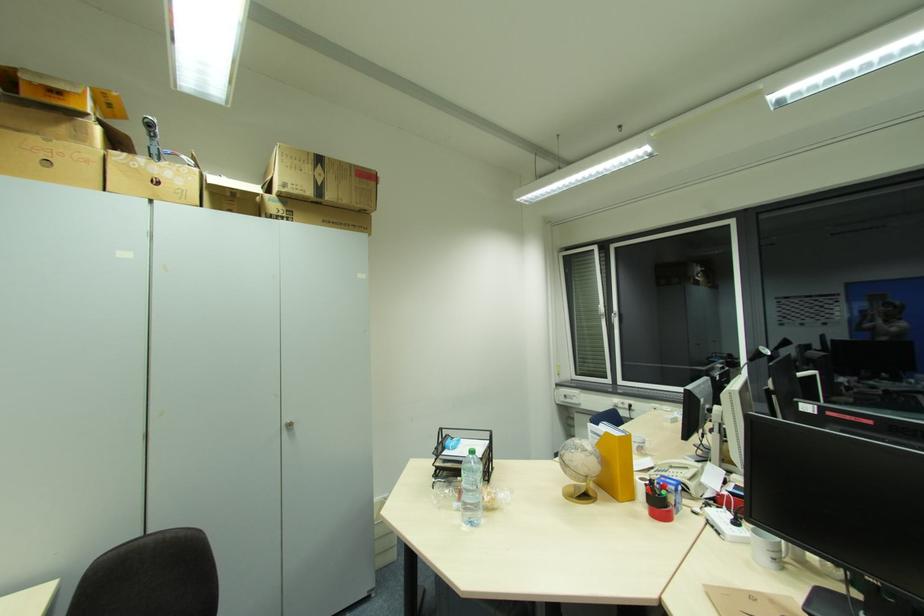
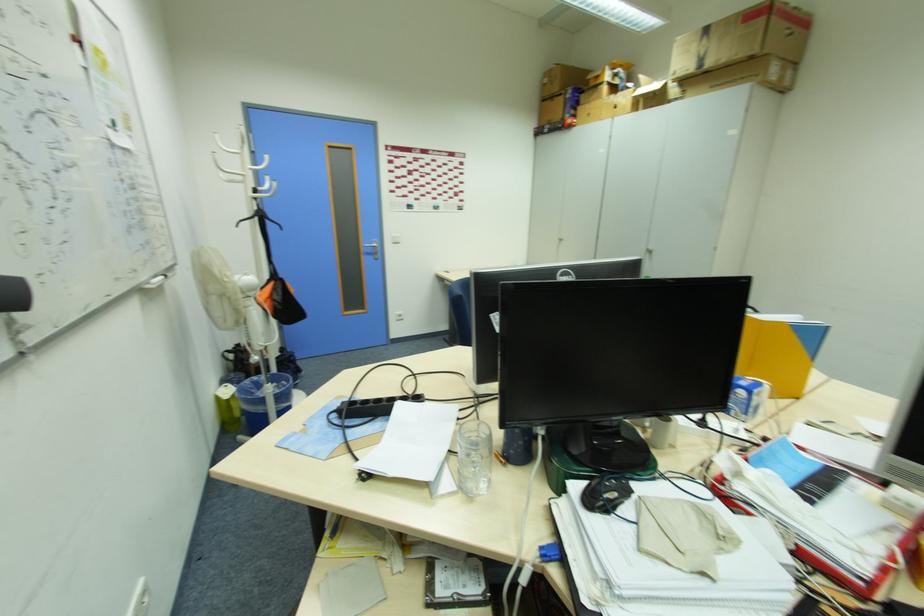
In the second image, find the point that corresponds to the point at 293,187 in the first image.

(685, 71)